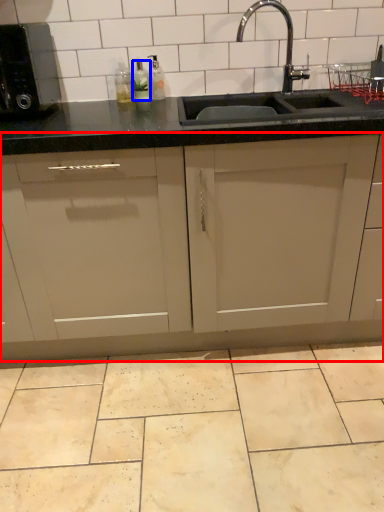
Question: Which object is further to the camera taking this photo, cabinetry (highlighted by a red box) or bottle (highlighted by a blue box)?

Choices:
 (A) cabinetry
 (B) bottle

Answer: (B)